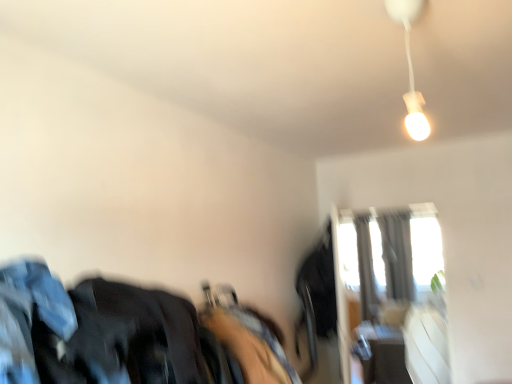
Question: Considering the relative sizes of dark blue fabric at left and silky gray curtain at upper right in the image provided, is dark blue fabric at left smaller than silky gray curtain at upper right?

Choices:
 (A) yes
 (B) no

Answer: (A)

Question: Does dark blue fabric at left have a lesser height compared to silky gray curtain at upper right?

Choices:
 (A) yes
 (B) no

Answer: (A)

Question: Is dark blue fabric at left behind silky gray curtain at upper right?

Choices:
 (A) yes
 (B) no

Answer: (B)

Question: Can you confirm if dark blue fabric at left is bigger than silky gray curtain at upper right?

Choices:
 (A) no
 (B) yes

Answer: (A)

Question: Is silky gray curtain at upper right at the back of dark blue fabric at left?

Choices:
 (A) no
 (B) yes

Answer: (A)

Question: Considering the positions of point (385, 233) and point (373, 241), is point (385, 233) closer or farther from the camera than point (373, 241)?

Choices:
 (A) farther
 (B) closer

Answer: (B)

Question: Is silky gray curtain at upper right bigger or smaller than transparent glass window at upper right?

Choices:
 (A) big
 (B) small

Answer: (A)

Question: Is silky gray curtain at upper right spatially inside transparent glass window at upper right, or outside of it?

Choices:
 (A) inside
 (B) outside

Answer: (B)

Question: In terms of width, does silky gray curtain at upper right look wider or thinner when compared to transparent glass window at upper right?

Choices:
 (A) wide
 (B) thin

Answer: (A)

Question: Considering the positions of dark blue fabric at left and white matte lamp at upper right in the image, is dark blue fabric at left wider or thinner than white matte lamp at upper right?

Choices:
 (A) wide
 (B) thin

Answer: (A)

Question: Is dark blue fabric at left to the left or to the right of white matte lamp at upper right in the image?

Choices:
 (A) left
 (B) right

Answer: (A)

Question: Relative to white matte lamp at upper right, is dark blue fabric at left in front or behind?

Choices:
 (A) behind
 (B) front

Answer: (B)

Question: Is dark blue fabric at left taller or shorter than white matte lamp at upper right?

Choices:
 (A) short
 (B) tall

Answer: (A)

Question: Is transparent glass window at upper right wider or thinner than white matte lamp at upper right?

Choices:
 (A) thin
 (B) wide

Answer: (A)

Question: Does point (373, 372) appear closer or farther from the camera than point (410, 52)?

Choices:
 (A) farther
 (B) closer

Answer: (A)